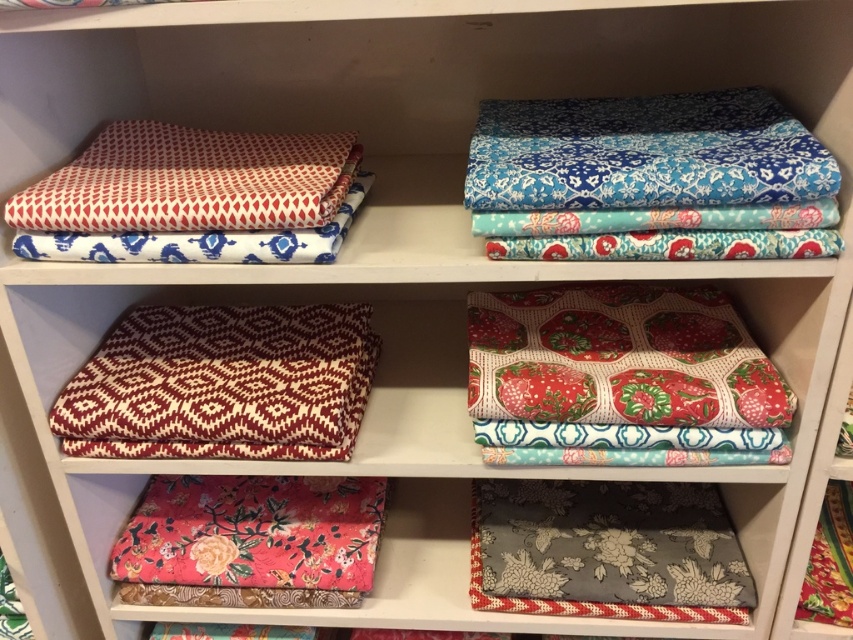
You are organizing a craft room and need to move a box that is 20 inches wide from the gray floral fabric at lower right to the matte white fabric at upper left. Can the box fit through the space between them?

The distance between the gray floral fabric at lower right and the matte white fabric at upper left is 22.48 inches. Since the box is 20 inches wide, it can fit through the space between them as the available space is wider than the box.

You are organizing a craft room and need to place a new fabric roll between the gray floral fabric at lower right and the matte white fabric at upper left. Based on their positions, which side should you place the new fabric roll on?

The gray floral fabric at lower right is to the right of the matte white fabric at upper left, so you should place the new fabric roll to the right of the matte white fabric at upper left and to the left of the gray floral fabric at lower right to maintain the order.